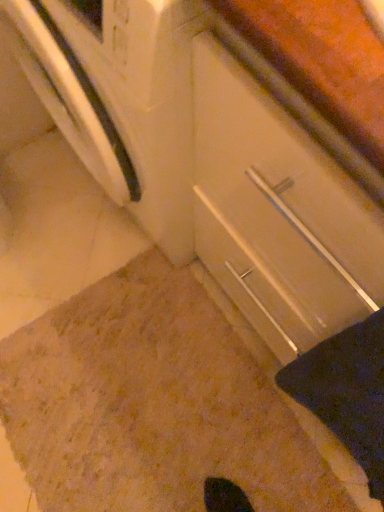
At what (x,y) coordinates should I click in order to perform the action: click on white glossy drawer at center. Please return your answer as a coordinate pair (x, y). Looking at the image, I should click on (278, 212).

At what (x,y) coordinates should I click in order to perform the action: click on blanket lying on the left of white glossy drawer at center. Please return your answer as a coordinate pair (x, y). Looking at the image, I should click on (347, 392).

Can you tell me how much white glossy drawer at center and black fabric at lower right differ in facing direction?

The angle between the facing direction of white glossy drawer at center and the facing direction of black fabric at lower right is 0.000545 degrees.

Consider the image. Who is bigger, white glossy drawer at center or black fabric at lower right?

white glossy drawer at center is bigger.

Looking at this image, is black fabric at lower right at the back of white glossy drawer at center?

No, white glossy drawer at center's orientation is not away from black fabric at lower right.

Does point (221, 431) appear closer or farther from the camera than point (381, 332)?

Clearly, point (221, 431) is more distant from the camera than point (381, 332).

Is brown textured carpet at lower center with black fabric at lower right?

brown textured carpet at lower center is not next to black fabric at lower right, and they're not touching.

From a real-world perspective, which object stands above the other?

black fabric at lower right is physically above.

Considering the sizes of brown textured carpet at lower center and black fabric at lower right in the image, is brown textured carpet at lower center bigger or smaller than black fabric at lower right?

Clearly, brown textured carpet at lower center is larger in size than black fabric at lower right.

From a real-world perspective, which object stands above the other?

In real-world perspective, black fabric at lower right is above.

Between black fabric at lower right and white glossy drawer at center, which one is positioned behind?

black fabric at lower right is further from the camera.

The width and height of the screenshot is (384, 512). In order to click on blanket above the white glossy drawer at center (from a real-world perspective) in this screenshot , I will do `click(347, 392)`.

Measure the distance between black fabric at lower right and white glossy drawer at center.

black fabric at lower right and white glossy drawer at center are 15.14 centimeters apart.

Which is more to the left, white glossy drawer at center or brown textured carpet at lower center?

Positioned to the left is brown textured carpet at lower center.

How many degrees apart are the facing directions of white glossy drawer at center and brown textured carpet at lower center?

The angle between the facing direction of white glossy drawer at center and the facing direction of brown textured carpet at lower center is 93 degrees.

Is white glossy drawer at center not inside brown textured carpet at lower center?

Indeed, white glossy drawer at center is completely outside brown textured carpet at lower center.

Between point (273, 216) and point (220, 362), which one is positioned behind?

Positioned behind is point (220, 362).

Is brown textured carpet at lower center inside black fabric at lower right?

No, brown textured carpet at lower center is located outside of black fabric at lower right.

Is black fabric at lower right not close to brown textured carpet at lower center?

black fabric at lower right is actually quite close to brown textured carpet at lower center.

Which object is positioned more to the left, black fabric at lower right or brown textured carpet at lower center?

From the viewer's perspective, brown textured carpet at lower center appears more on the left side.

In the scene shown: From the image's perspective, which one is positioned higher, black fabric at lower right or brown textured carpet at lower center?

From the image's view, black fabric at lower right is above.

The height and width of the screenshot is (512, 384). I want to click on granite located underneath the white glossy drawer at center (from a real-world perspective), so click(151, 404).

Is brown textured carpet at lower center not inside white glossy drawer at center?

brown textured carpet at lower center is positioned outside white glossy drawer at center.

Who is taller, brown textured carpet at lower center or white glossy drawer at center?

white glossy drawer at center.

The image size is (384, 512). Identify the location of blanket behind the white glossy drawer at center. (347, 392).

At what (x,y) coordinates should I click in order to perform the action: click on blanket lying in front of the brown textured carpet at lower center. Please return your answer as a coordinate pair (x, y). The width and height of the screenshot is (384, 512). Looking at the image, I should click on (347, 392).

In the scene shown: Looking at the image, which one is located further to brown textured carpet at lower center, black fabric at lower right or white glossy drawer at center?

The object further to brown textured carpet at lower center is white glossy drawer at center.

Looking at the image, which one is located closer to white glossy drawer at center, brown textured carpet at lower center or black fabric at lower right?

The object closer to white glossy drawer at center is black fabric at lower right.

Which object lies nearer to the anchor point black fabric at lower right, brown textured carpet at lower center or white glossy drawer at center?

white glossy drawer at center.

Based on their spatial positions, is black fabric at lower right or brown textured carpet at lower center further from white glossy drawer at center?

The object further to white glossy drawer at center is brown textured carpet at lower center.

Looking at the image, which one is located further to brown textured carpet at lower center, white glossy drawer at center or black fabric at lower right?

white glossy drawer at center is further to brown textured carpet at lower center.

When comparing their distances from black fabric at lower right, does white glossy drawer at center or brown textured carpet at lower center seem closer?

white glossy drawer at center.

Identify the location of blanket located between white glossy drawer at center and brown textured carpet at lower center in the depth direction. Image resolution: width=384 pixels, height=512 pixels. pos(347,392).